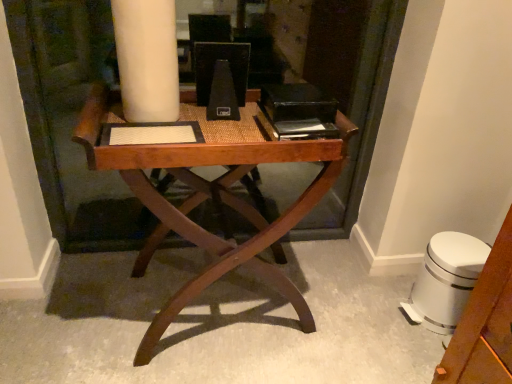
The width and height of the screenshot is (512, 384). I want to click on space that is in front of white plastic swivel chair at lower right, so click(420, 346).